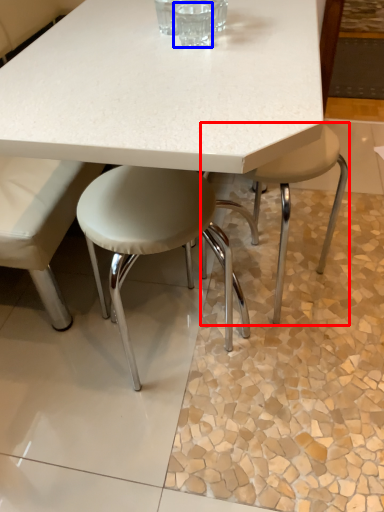
Question: Which object appears closest to the camera in this image, stool (highlighted by a red box) or clear (highlighted by a blue box)?

Choices:
 (A) stool
 (B) clear

Answer: (B)